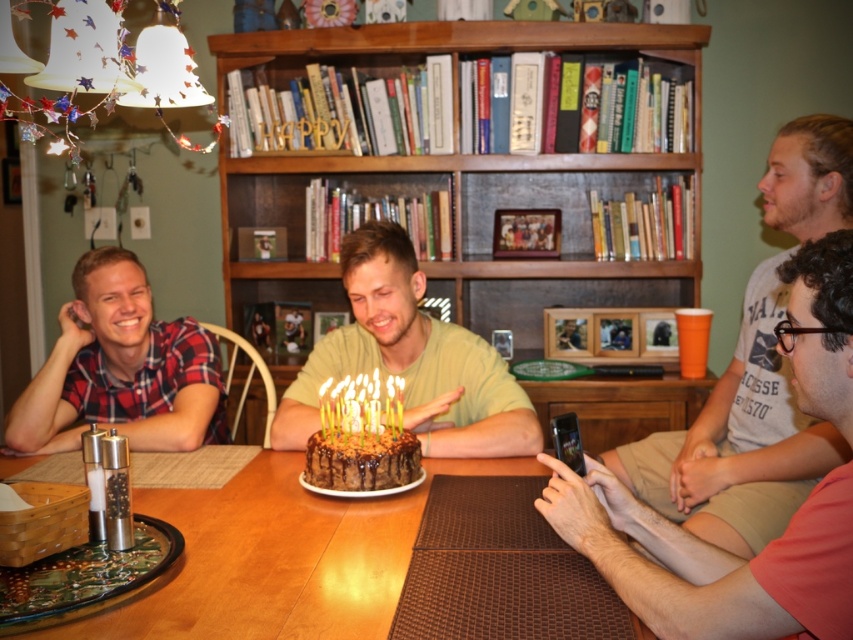
Does chocolate cake at center appear on the left side of chocolate frosted cake at center?

Incorrect, chocolate cake at center is not on the left side of chocolate frosted cake at center.

Is point (447, 445) positioned in front of point (381, 445)?

No, it is behind (381, 445).

Who is more forward, (485,390) or (408,481)?

Point (408,481) is more forward.

The width and height of the screenshot is (853, 640). What are the coordinates of `chocolate cake at center` in the screenshot? It's located at (410, 360).

This screenshot has width=853, height=640. Describe the element at coordinates (410, 360) in the screenshot. I see `chocolate cake at center` at that location.

Between chocolate cake at center and plaid fabric shirt at left, which one is positioned lower?

chocolate cake at center

What do you see at coordinates (410, 360) in the screenshot? I see `chocolate cake at center` at bounding box center [410, 360].

This screenshot has height=640, width=853. I want to click on chocolate cake at center, so click(x=410, y=360).

In the scene shown: Which of these two, gray cotton t-shirt at center or chocolate cake at center, stands taller?

With more height is gray cotton t-shirt at center.

Measure the distance between gray cotton t-shirt at center and chocolate cake at center.

They are 23.12 inches apart.

In order to click on gray cotton t-shirt at center in this screenshot , I will do `click(737, 440)`.